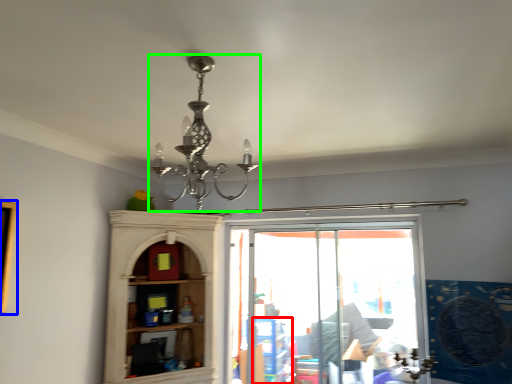
Question: Which object is positioned closest to shelf (highlighted by a red box)? Select from picture frame (highlighted by a blue box) and lamp (highlighted by a green box).

Choices:
 (A) picture frame
 (B) lamp

Answer: (A)